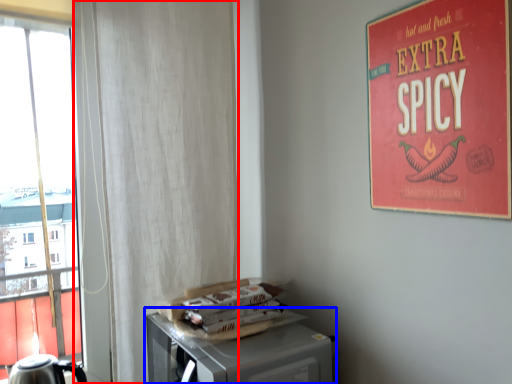
Question: Which of the following is the farthest to the observer, curtain (highlighted by a red box) or table (highlighted by a blue box)?

Choices:
 (A) curtain
 (B) table

Answer: (A)